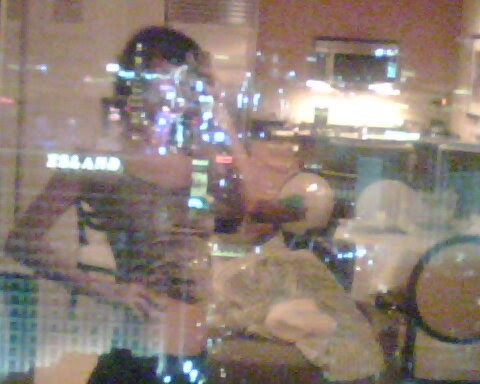
Find the location of a particular element. chairs is located at coordinates (258, 363), (459, 289), (404, 197), (307, 198), (269, 156), (94, 252).